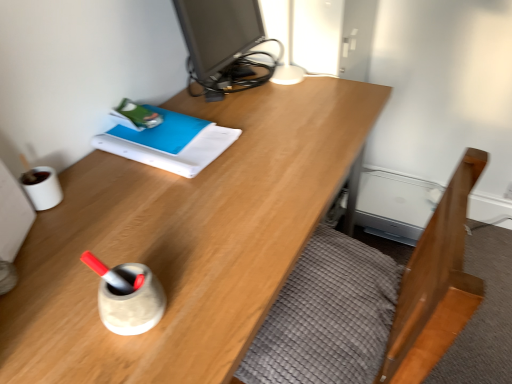
I want to click on free space behind blue matte book at upper left, so click(x=214, y=102).